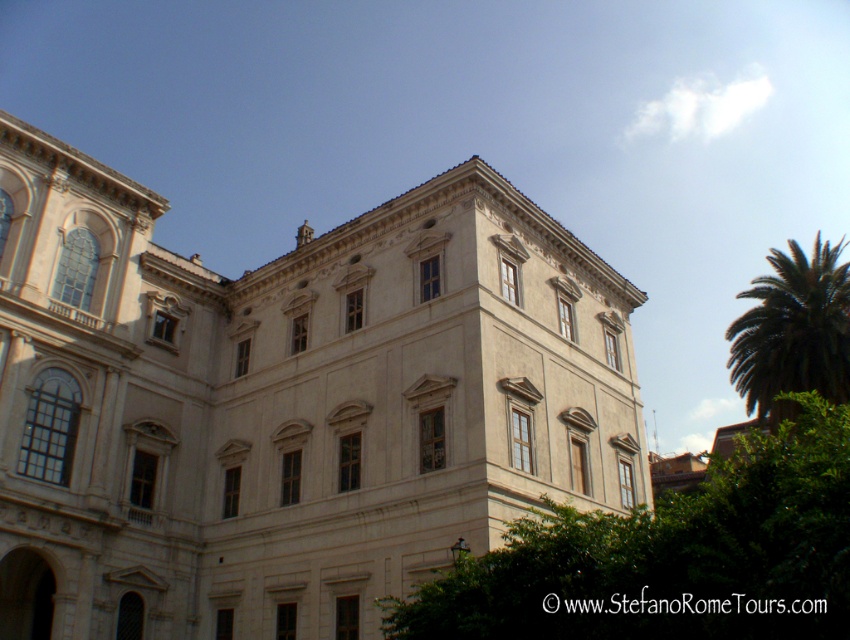
Question: Considering the real-world distances, which object is closest to the white stone building at center?

Choices:
 (A) green leafy palm at upper right
 (B) green leafy tree at center

Answer: (B)

Question: Is white stone building at center to the right of green leafy palm at upper right from the viewer's perspective?

Choices:
 (A) yes
 (B) no

Answer: (B)

Question: Among these objects, which one is nearest to the camera?

Choices:
 (A) green leafy palm at upper right
 (B) green leafy tree at center
 (C) white stone building at center

Answer: (B)

Question: Does white stone building at center appear on the left side of green leafy tree at center?

Choices:
 (A) yes
 (B) no

Answer: (A)

Question: Which object appears closest to the camera in this image?

Choices:
 (A) green leafy tree at center
 (B) green leafy palm at upper right

Answer: (A)

Question: Does green leafy tree at center come behind green leafy palm at upper right?

Choices:
 (A) yes
 (B) no

Answer: (B)